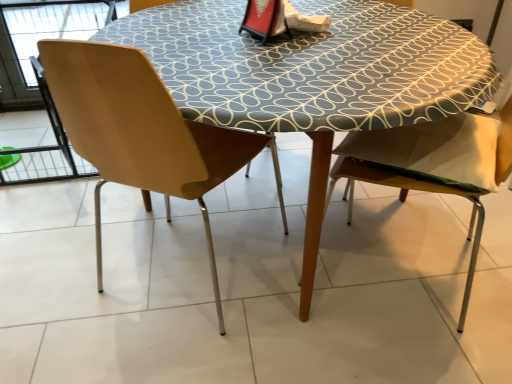
Image resolution: width=512 pixels, height=384 pixels. Find the location of `matte wood chair at left, arranged as the second chair when viewed from the right`. matte wood chair at left, arranged as the second chair when viewed from the right is located at coordinates (142, 132).

Identify the location of matte wood chair at left, arranged as the 1th chair when viewed from the left. The width and height of the screenshot is (512, 384). (142, 132).

Is wooden chair at right, the 2th chair when ordered from left to right, taller or shorter than wooden table at center?

Clearly, wooden chair at right, the 2th chair when ordered from left to right, is taller compared to wooden table at center.

Is wooden table at center completely or partially inside wooden chair at right, which is the 1th chair from right to left?

No, wooden table at center is not a part of wooden chair at right, which is the 1th chair from right to left.

From a real-world perspective, which object rests below the other?

wooden table at center.

Considering the positions of objects wooden chair at right, which is the 1th chair from right to left, and wooden table at center in the image provided, who is more to the left, wooden chair at right, which is the 1th chair from right to left, or wooden table at center?

wooden table at center is more to the left.

Measure the distance from matte wood chair at left, arranged as the 1th chair when viewed from the left, to wooden chair at right, which is the 1th chair from right to left.

A distance of 18.62 inches exists between matte wood chair at left, arranged as the 1th chair when viewed from the left, and wooden chair at right, which is the 1th chair from right to left.

Is matte wood chair at left, arranged as the 1th chair when viewed from the left, further to camera compared to wooden chair at right, which is the 1th chair from right to left?

Yes, matte wood chair at left, arranged as the 1th chair when viewed from the left, is further from the camera.

Between matte wood chair at left, arranged as the 1th chair when viewed from the left, and wooden chair at right, which is the 1th chair from right to left, which one has less height?

With less height is wooden chair at right, which is the 1th chair from right to left.

Between point (95, 80) and point (249, 104), which one is positioned in front?

The point (95, 80) is closer.

Is matte wood chair at left, arranged as the second chair when viewed from the right, in contact with wooden table at center?

matte wood chair at left, arranged as the second chair when viewed from the right, and wooden table at center are not in contact.

Consider the image. Between matte wood chair at left, arranged as the second chair when viewed from the right, and wooden table at center, which one appears on the right side from the viewer's perspective?

wooden table at center.

From the image's perspective, would you say matte wood chair at left, arranged as the 1th chair when viewed from the left, is positioned over wooden table at center?

Actually, matte wood chair at left, arranged as the 1th chair when viewed from the left, appears below wooden table at center in the image.

From the image's perspective, which is below, wooden table at center or matte wood chair at left, arranged as the second chair when viewed from the right?

matte wood chair at left, arranged as the second chair when viewed from the right.

From a real-world perspective, is wooden table at center under matte wood chair at left, arranged as the second chair when viewed from the right?

Yes, from a real-world perspective, wooden table at center is under matte wood chair at left, arranged as the second chair when viewed from the right.

Is wooden table at center aimed at matte wood chair at left, arranged as the second chair when viewed from the right?

Yes, wooden table at center is facing matte wood chair at left, arranged as the second chair when viewed from the right.

Considering the sizes of wooden table at center and matte wood chair at left, arranged as the 1th chair when viewed from the left, in the image, is wooden table at center wider or thinner than matte wood chair at left, arranged as the 1th chair when viewed from the left,?

wooden table at center is wider than matte wood chair at left, arranged as the 1th chair when viewed from the left.

Consider the image. How much distance is there between wooden chair at right, the 2th chair when ordered from left to right, and matte wood chair at left, arranged as the second chair when viewed from the right?

The distance of wooden chair at right, the 2th chair when ordered from left to right, from matte wood chair at left, arranged as the second chair when viewed from the right, is 18.62 inches.

From a real-world perspective, is wooden chair at right, the 2th chair when ordered from left to right, below matte wood chair at left, arranged as the 1th chair when viewed from the left?

Correct, in the physical world, wooden chair at right, the 2th chair when ordered from left to right, is lower than matte wood chair at left, arranged as the 1th chair when viewed from the left.

In the scene shown: Considering the relative sizes of wooden chair at right, which is the 1th chair from right to left, and matte wood chair at left, arranged as the second chair when viewed from the right, in the image provided, is wooden chair at right, which is the 1th chair from right to left, shorter than matte wood chair at left, arranged as the second chair when viewed from the right,?

Yes.

Which object is more forward, wooden chair at right, the 2th chair when ordered from left to right, or matte wood chair at left, arranged as the second chair when viewed from the right?

wooden chair at right, the 2th chair when ordered from left to right.

Identify the location of chair that is the 2nd one when counting forward from the wooden table at center. The image size is (512, 384). (405, 199).

Are wooden table at center and wooden chair at right, which is the 1th chair from right to left, beside each other?

They are not placed beside each other.

Between wooden table at center and wooden chair at right, which is the 1th chair from right to left, which one appears on the right side from the viewer's perspective?

From the viewer's perspective, wooden chair at right, which is the 1th chair from right to left, appears more on the right side.

Does point (424, 45) appear closer or farther from the camera than point (361, 170)?

Point (424, 45) is farther from the camera than point (361, 170).

Find the location of `the 1st chair positioned above the wooden table at center (from a real-world perspective)`. the 1st chair positioned above the wooden table at center (from a real-world perspective) is located at coordinates pyautogui.click(x=405, y=199).

Identify the location of chair located above the wooden chair at right, which is the 1th chair from right to left (from the image's perspective). The width and height of the screenshot is (512, 384). (142, 132).

Which object lies nearer to the anchor point wooden chair at right, which is the 1th chair from right to left, matte wood chair at left, arranged as the 1th chair when viewed from the left, or wooden table at center?

Among the two, wooden table at center is located nearer to wooden chair at right, which is the 1th chair from right to left.

When comparing their distances from matte wood chair at left, arranged as the 1th chair when viewed from the left, does wooden table at center or wooden chair at right, the 2th chair when ordered from left to right, seem further?

wooden chair at right, the 2th chair when ordered from left to right, lies further to matte wood chair at left, arranged as the 1th chair when viewed from the left, than the other object.

Based on their spatial positions, is wooden chair at right, the 2th chair when ordered from left to right, or wooden table at center closer to matte wood chair at left, arranged as the second chair when viewed from the right?

wooden table at center is positioned closer to the anchor matte wood chair at left, arranged as the second chair when viewed from the right.

In the scene shown: Looking at the image, which one is located further to wooden table at center, matte wood chair at left, arranged as the second chair when viewed from the right, or wooden chair at right, which is the 1th chair from right to left?

wooden chair at right, which is the 1th chair from right to left, is positioned further to the anchor wooden table at center.

Considering their positions, is wooden table at center positioned further to wooden chair at right, the 2th chair when ordered from left to right, than matte wood chair at left, arranged as the 1th chair when viewed from the left?

Based on the image, matte wood chair at left, arranged as the 1th chair when viewed from the left, appears to be further to wooden chair at right, the 2th chair when ordered from left to right.

Which object lies further to the anchor point wooden table at center, wooden chair at right, which is the 1th chair from right to left, or matte wood chair at left, arranged as the 1th chair when viewed from the left?

wooden chair at right, which is the 1th chair from right to left, is positioned further to the anchor wooden table at center.

I want to click on table between matte wood chair at left, arranged as the second chair when viewed from the right, and wooden chair at right, which is the 1th chair from right to left, so click(x=311, y=77).